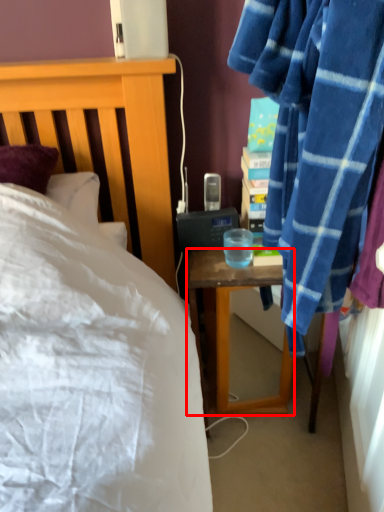
Question: From the image's perspective, where is desk (annotated by the red box) located relative to coffee cup?

Choices:
 (A) below
 (B) above

Answer: (A)